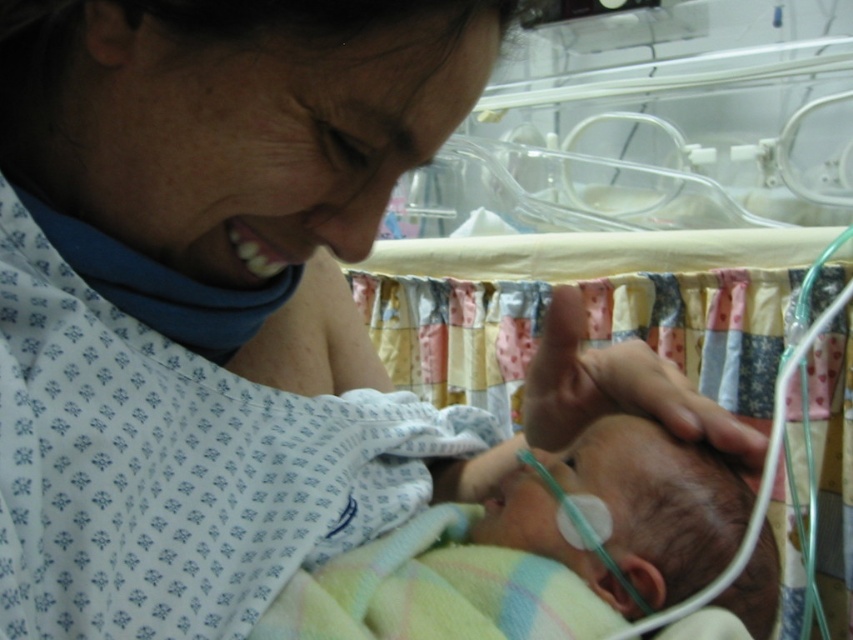
Between point (596, 93) and point (630, 496), which one is positioned in front?

Point (630, 496)

Can you confirm if patchwork fabric infant bed at center is smaller than smooth skin newborn at center?

No.

Is point (624, 257) more distant than point (561, 548)?

That is True.

Where is `patchwork fabric infant bed at center`? The width and height of the screenshot is (853, 640). patchwork fabric infant bed at center is located at coordinates (616, 216).